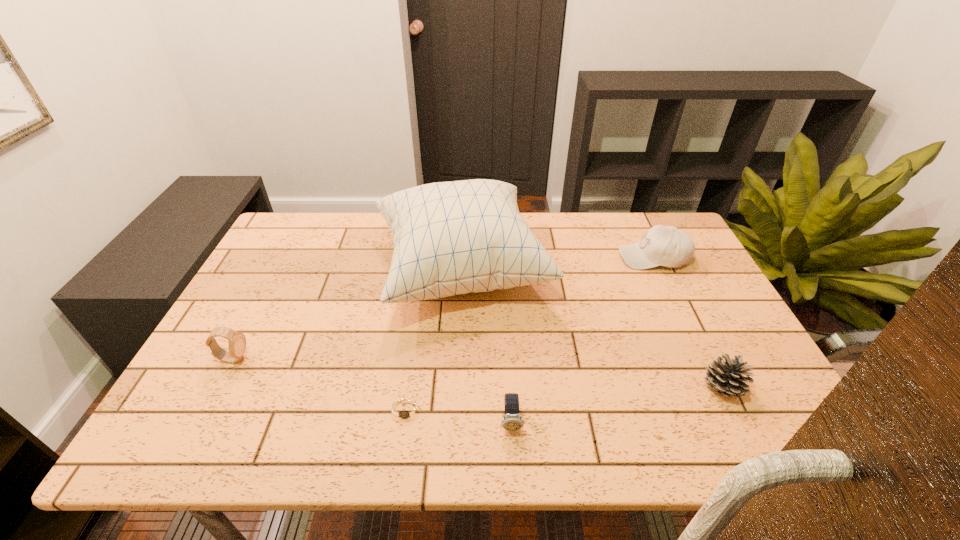
In order to click on vacant space situated 0.250m on the front-facing side of the baseball cap in this screenshot , I will do `click(538, 257)`.

Locate an element on the screen. vacant space located on the front-facing side of the baseball cap is located at coordinates tap(566, 257).

In order to click on vacant area situated on the front-facing side of the baseball cap in this screenshot , I will do `click(557, 257)`.

I want to click on vacant space located on the face of the tallest watch, so click(372, 359).

This screenshot has width=960, height=540. Identify the location of vacant region located on the left of the pinecone. (666, 388).

You are a GUI agent. You are given a task and a screenshot of the screen. Output one action in this format:
    pyautogui.click(x=<x>, y=<y>)
    Task: Click on the cushion that is at the far edge
    
    Given the screenshot: What is the action you would take?
    pyautogui.click(x=450, y=238)

I want to click on baseball cap that is positioned at the far edge, so click(x=668, y=246).

This screenshot has width=960, height=540. Find the location of `object that is at the left edge`. object that is at the left edge is located at coordinates (237, 341).

What are the coordinates of `baseball cap at the right edge` in the screenshot? It's located at (668, 246).

The image size is (960, 540). What are the coordinates of `pinecone that is at the right edge` in the screenshot? It's located at (729, 378).